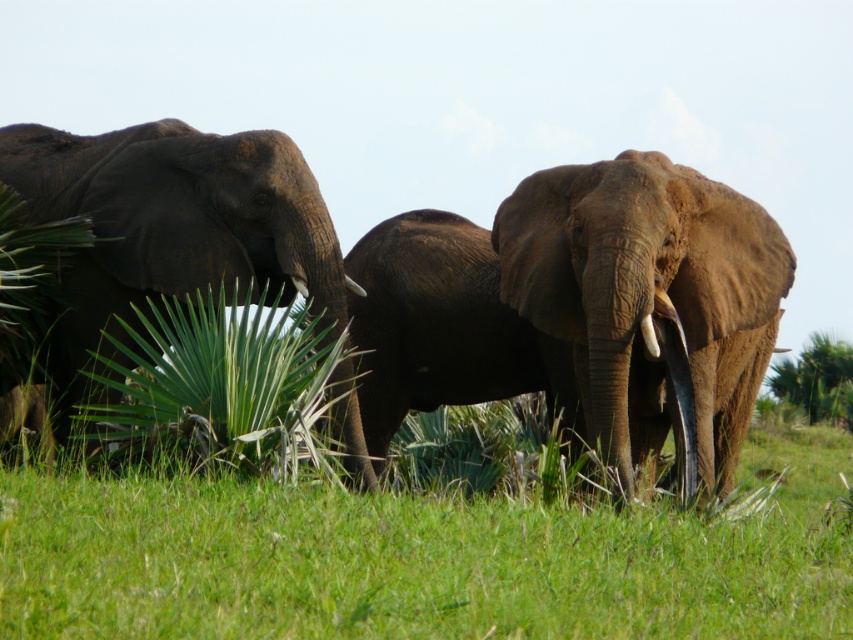
Question: Among these points, which one is nearest to the camera?

Choices:
 (A) (845, 371)
 (B) (39, 150)
 (C) (712, 269)

Answer: (C)

Question: Does brown rough elephant at center lie behind white ivory tusk at center?

Choices:
 (A) no
 (B) yes

Answer: (A)

Question: Which point appears closest to the camera in this image?

Choices:
 (A) (4, 170)
 (B) (352, 292)
 (C) (810, 380)
 (D) (657, 356)

Answer: (D)

Question: Is dark brown elephant at left below green leafy tree at center?

Choices:
 (A) no
 (B) yes

Answer: (A)

Question: Which of the following is the closest to the observer?

Choices:
 (A) (x=837, y=417)
 (B) (x=358, y=289)
 (C) (x=645, y=344)

Answer: (C)

Question: Is dark brown elephant at left wider than green leafy tree at center?

Choices:
 (A) yes
 (B) no

Answer: (A)